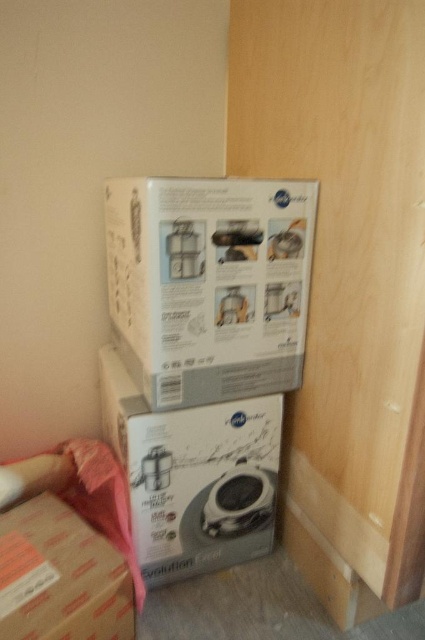
Who is shorter, white matte box at upper left or white glossy box at center?

With less height is white matte box at upper left.

Does point (223, 180) come behind point (113, 444)?

No, it is in front of (113, 444).

Identify the location of white matte box at upper left. The height and width of the screenshot is (640, 425). (209, 284).

Does white glossy box at center have a smaller size compared to brown cardboard at lower left?

No, white glossy box at center is not smaller than brown cardboard at lower left.

Between point (234, 490) and point (36, 588), which one is positioned in front?

Point (36, 588) is in front.

Describe the element at coordinates (193, 476) in the screenshot. I see `white glossy box at center` at that location.

What are the coordinates of `white glossy box at center` in the screenshot? It's located at (193, 476).

Who is lower down, brown cardboard at lower left or matte white appliance at lower center?

Positioned lower is brown cardboard at lower left.

Which is behind, point (39, 611) or point (232, 497)?

The point (232, 497) is behind.

Find the location of a particular element. brown cardboard at lower left is located at coordinates (61, 577).

Locate an element on the screen. brown cardboard at lower left is located at coordinates (61, 577).